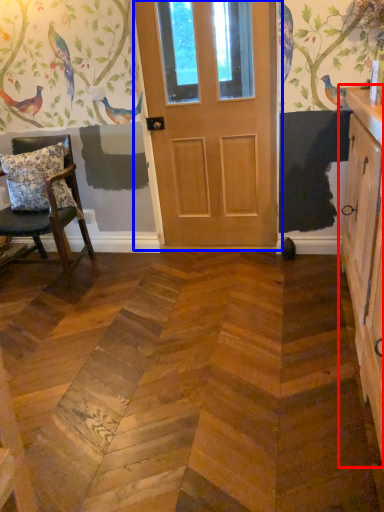
Question: Which object appears farthest to the camera in this image, cabinetry (highlighted by a red box) or door (highlighted by a blue box)?

Choices:
 (A) cabinetry
 (B) door

Answer: (B)